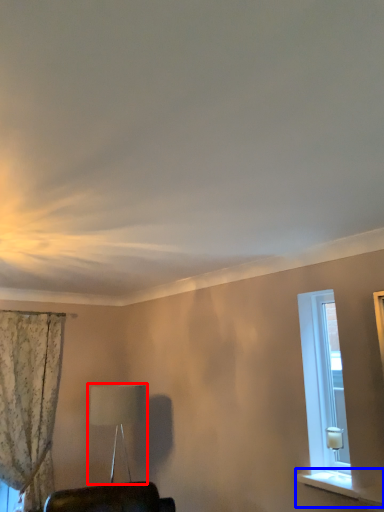
Question: Which of the following is the farthest to the observer, table lamp (highlighted by a red box) or window sill (highlighted by a blue box)?

Choices:
 (A) table lamp
 (B) window sill

Answer: (A)